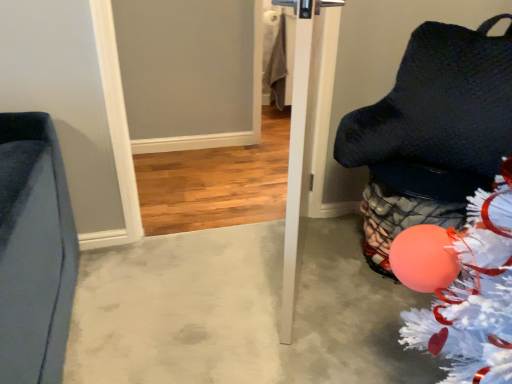
Image resolution: width=512 pixels, height=384 pixels. What are the coordinates of `free spot below white smooth door at center (from a real-world perspective)` in the screenshot? It's located at (297, 287).